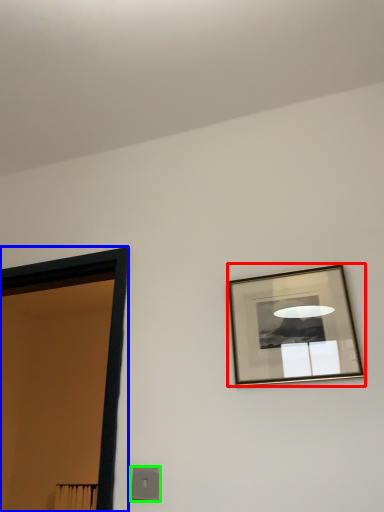
Question: Which object is the farthest from picture frame (highlighted by a red box)? Choose among these: door (highlighted by a blue box) or light switch (highlighted by a green box).

Choices:
 (A) door
 (B) light switch

Answer: (A)